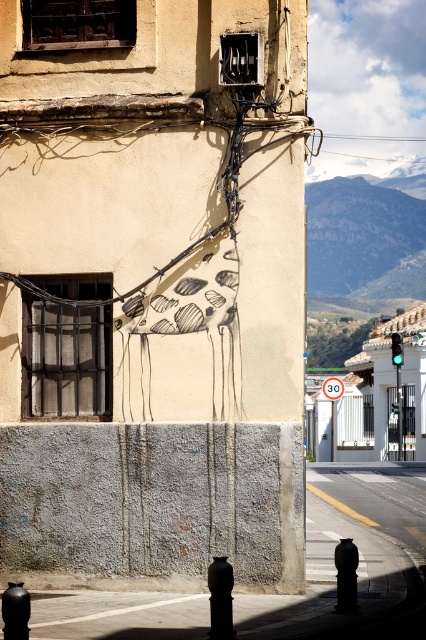
From the picture: You are a pedestrian standing on the sidewalk looking at the orange plastic speed limit sign at center and the green glass traffic light at right. Which object is closer to your left side?

The orange plastic speed limit sign at center is closer to your left side because it is positioned to the left of the green glass traffic light at right.

You are a pedestrian standing on the sidewalk looking at the orange plastic speed limit sign at center and the green glass traffic light at right. Which object is closer to you?

The orange plastic speed limit sign at center is closer to you because it is further to the viewer than the green glass traffic light at right.